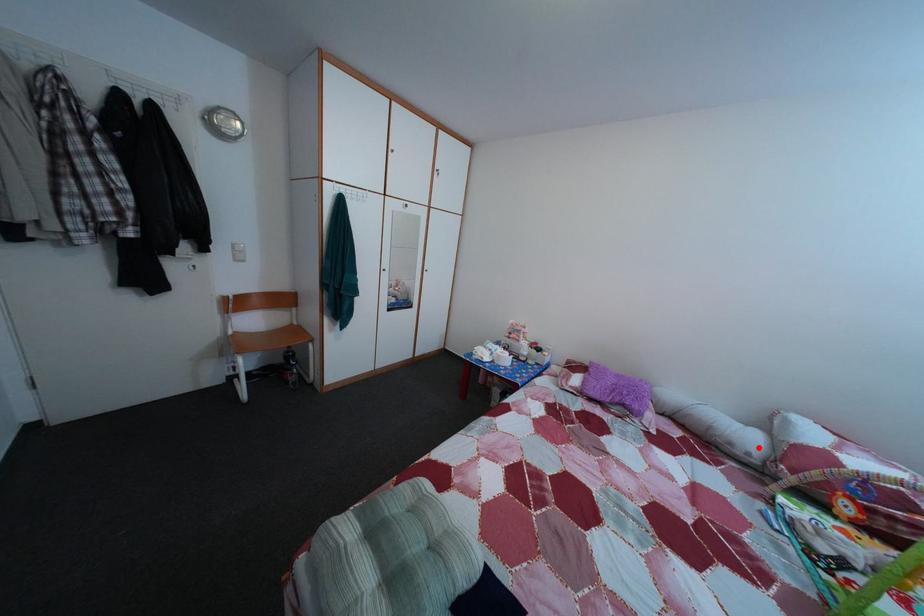
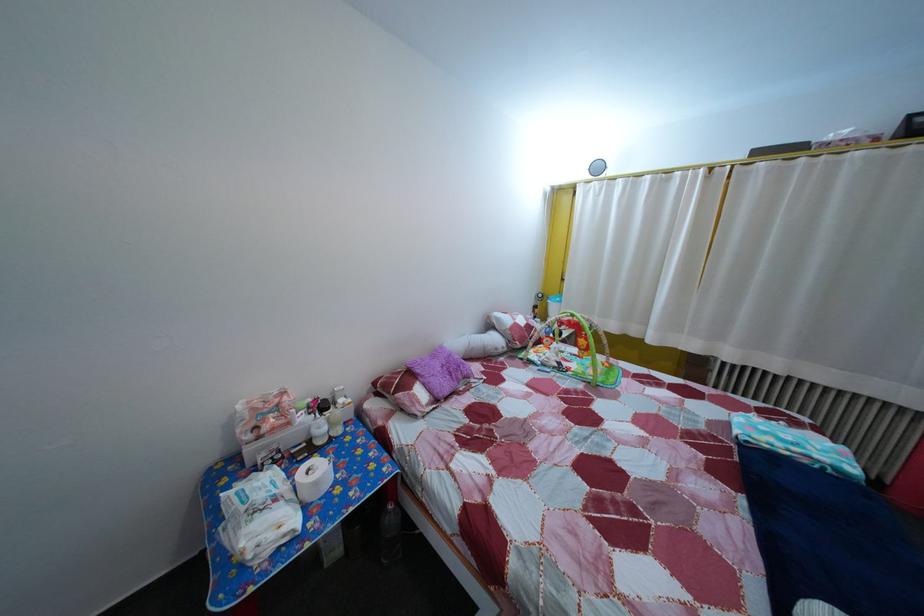
Find the pixel in the second image that matches the highlighted location in the first image.

(505, 347)